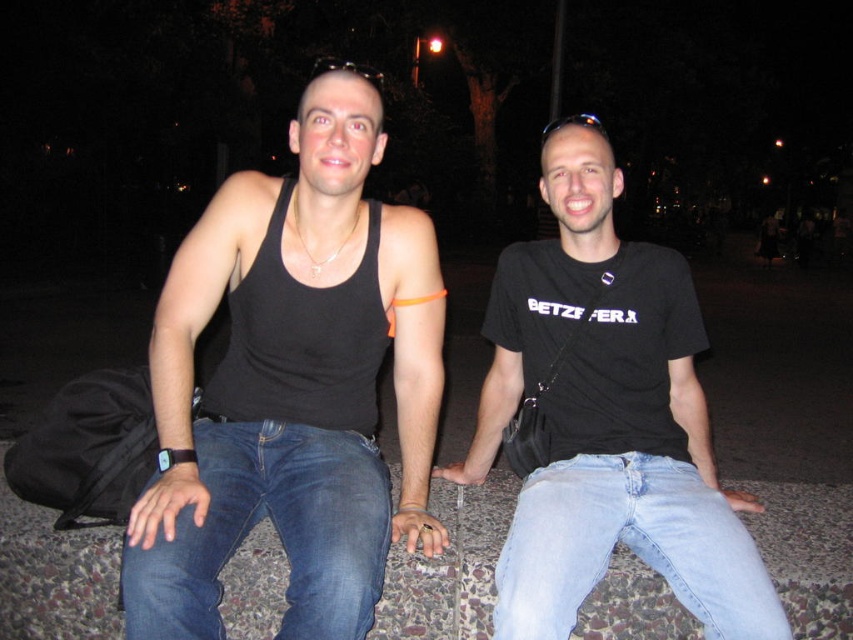
You are standing at the point labeled as point (642,426) in the image. You want to take a photo of the two people sitting on the textured stone surface using a camera that has a maximum focus range of 2 meters. Will the camera be able to focus on the two people if you are at that point?

The point labeled as point (642,426) and the camera are 1.93 meters apart. Since the maximum focus range of the camera is 2 meters, the distance of 1.93 meters is within the limit. Therefore, the camera can focus on the two people when positioned at that point.